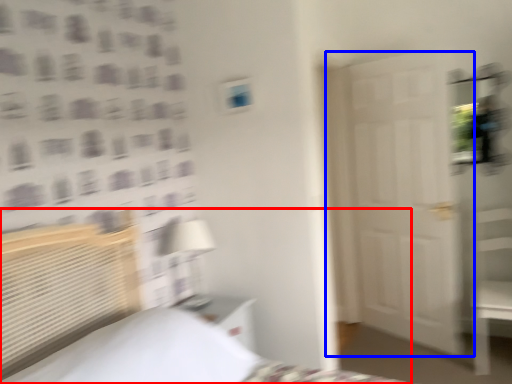
Question: Among these objects, which one is nearest to the camera, bed (highlighted by a red box) or door (highlighted by a blue box)?

Choices:
 (A) bed
 (B) door

Answer: (A)